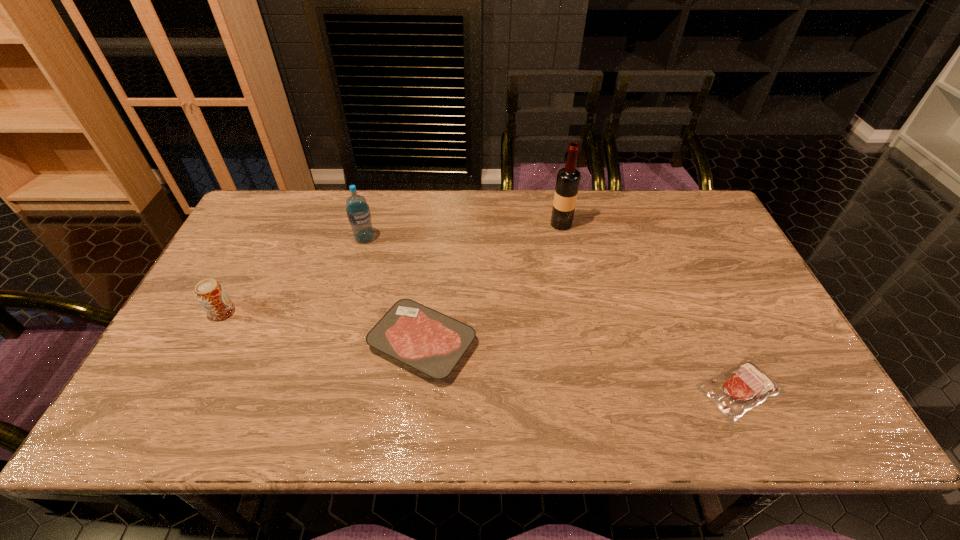
The height and width of the screenshot is (540, 960). I want to click on free space located 0.100m on the front of the tallest object, so click(x=566, y=252).

Locate an element on the screen. This screenshot has width=960, height=540. vacant space situated on the front of the second tallest object is located at coordinates (340, 329).

Where is `free space located 0.270m on the back of the leftmost object`? This screenshot has width=960, height=540. free space located 0.270m on the back of the leftmost object is located at coordinates (262, 238).

Where is `free space located on the right of the left steak`? Image resolution: width=960 pixels, height=540 pixels. free space located on the right of the left steak is located at coordinates (512, 343).

Identify the location of vacant point located 0.170m on the back of the shortest object. The height and width of the screenshot is (540, 960). (701, 303).

Identify the location of wine bottle at the far edge. The height and width of the screenshot is (540, 960). (568, 179).

Identify the location of water bottle at the far edge. The width and height of the screenshot is (960, 540). (358, 212).

In order to click on object present at the near edge in this screenshot , I will do `click(734, 392)`.

The height and width of the screenshot is (540, 960). Find the location of `object that is at the left edge`. object that is at the left edge is located at coordinates (210, 293).

Image resolution: width=960 pixels, height=540 pixels. Identify the location of object that is positioned at the right edge. (734, 392).